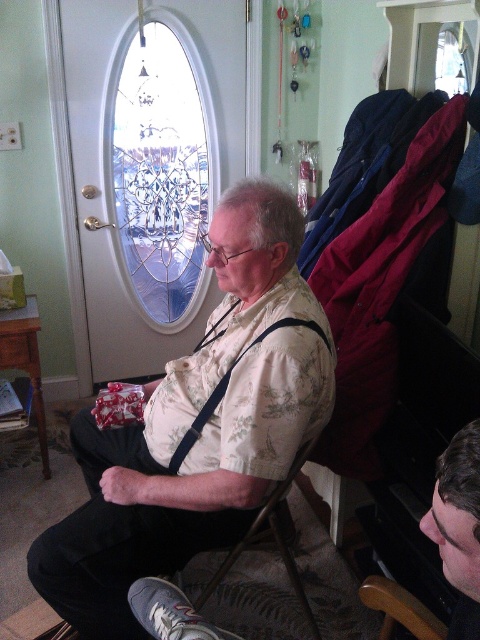
Question: Can you confirm if clear glass window at upper center is smaller than black fabric suspenders at center?

Choices:
 (A) no
 (B) yes

Answer: (A)

Question: Estimate the real-world distances between objects in this image. Which object is closer to the black fabric suspenders at center?

Choices:
 (A) clear glass window at upper center
 (B) metallic gray chair at lower center

Answer: (B)

Question: Can you confirm if floral shirt at center is thinner than dark brown hair at lower right?

Choices:
 (A) yes
 (B) no

Answer: (B)

Question: Does clear glass window at upper center appear on the right side of dark brown hair at lower right?

Choices:
 (A) no
 (B) yes

Answer: (A)

Question: Which object appears closest to the camera in this image?

Choices:
 (A) floral shirt at center
 (B) dark brown hair at lower right
 (C) metallic gray chair at lower center

Answer: (B)

Question: Which of the following is the closest to the observer?

Choices:
 (A) metallic gray chair at lower center
 (B) clear glass window at upper center

Answer: (A)